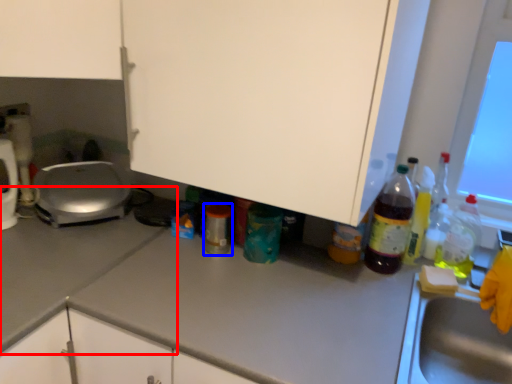
Question: Among these objects, which one is farthest to the camera, counter top (highlighted by a red box) or bottle (highlighted by a blue box)?

Choices:
 (A) counter top
 (B) bottle

Answer: (B)